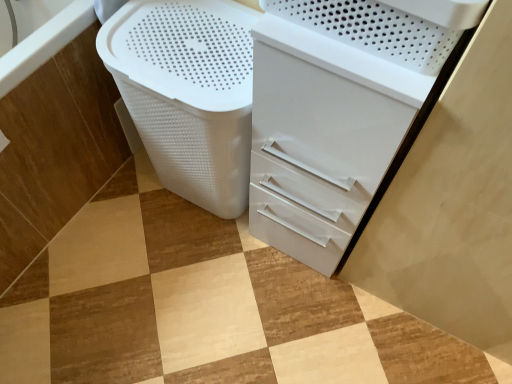
Question: Is white plastic basket at lower left bigger than white glossy file cabinet at center?

Choices:
 (A) no
 (B) yes

Answer: (A)

Question: Can you confirm if white plastic basket at lower left is wider than white glossy file cabinet at center?

Choices:
 (A) no
 (B) yes

Answer: (A)

Question: Can white glossy file cabinet at center be found inside white plastic basket at lower left?

Choices:
 (A) yes
 (B) no

Answer: (B)

Question: Would you say white plastic basket at lower left is outside white glossy file cabinet at center?

Choices:
 (A) yes
 (B) no

Answer: (A)

Question: From a real-world perspective, is white plastic basket at lower left located higher than white glossy file cabinet at center?

Choices:
 (A) no
 (B) yes

Answer: (A)

Question: Choose the correct answer: Is white plastic basket at lower left inside white glossy file cabinet at center or outside it?

Choices:
 (A) outside
 (B) inside

Answer: (A)

Question: Considering the positions of white plastic basket at lower left and white glossy file cabinet at center in the image, is white plastic basket at lower left wider or thinner than white glossy file cabinet at center?

Choices:
 (A) wide
 (B) thin

Answer: (B)

Question: Considering the positions of point (55, 112) and point (266, 240), is point (55, 112) closer or farther from the camera than point (266, 240)?

Choices:
 (A) farther
 (B) closer

Answer: (B)

Question: From the image's perspective, is white plastic basket at lower left positioned above or below white glossy file cabinet at center?

Choices:
 (A) below
 (B) above

Answer: (B)

Question: Relative to white plastic basket at lower left, is white glossy file cabinet at center in front or behind?

Choices:
 (A) behind
 (B) front

Answer: (B)

Question: Considering the positions of white glossy file cabinet at center and white plastic basket at lower left in the image, is white glossy file cabinet at center wider or thinner than white plastic basket at lower left?

Choices:
 (A) thin
 (B) wide

Answer: (B)

Question: From the image's perspective, is white glossy file cabinet at center above or below white plastic basket at lower left?

Choices:
 (A) above
 (B) below

Answer: (B)

Question: In terms of size, does white glossy file cabinet at center appear bigger or smaller than white plastic basket at lower left?

Choices:
 (A) small
 (B) big

Answer: (B)

Question: Considering the positions of white plastic laundry basket at lower left and white glossy file cabinet at center in the image, is white plastic laundry basket at lower left wider or thinner than white glossy file cabinet at center?

Choices:
 (A) thin
 (B) wide

Answer: (B)

Question: From the image's perspective, is white plastic laundry basket at lower left positioned above or below white glossy file cabinet at center?

Choices:
 (A) below
 (B) above

Answer: (B)